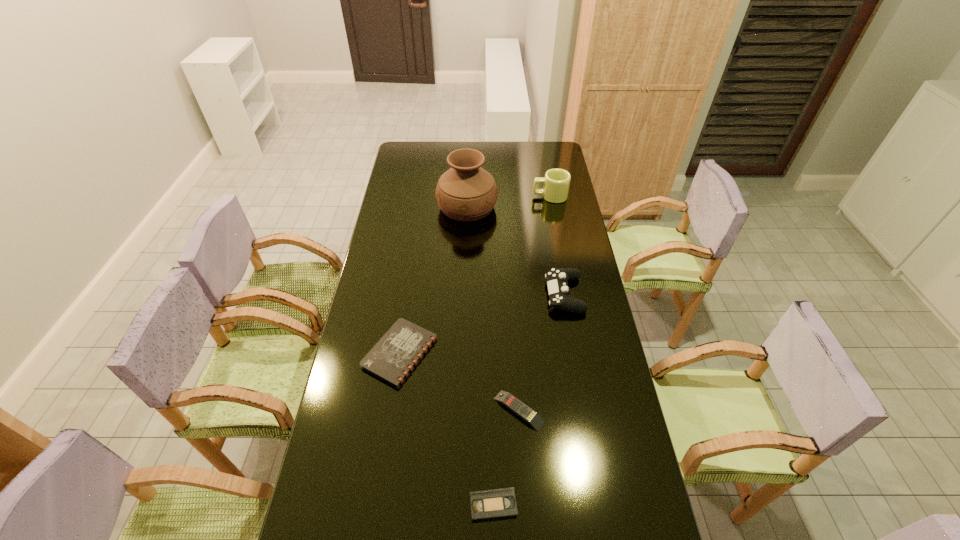
This screenshot has height=540, width=960. Identify the location of empty location between the remote control and the notebook. (460, 382).

What are the coordinates of `blank region between the fourth nearest object and the tallest object` in the screenshot? It's located at (516, 251).

Identify which object is the nearest to the second nearest object. Please provide its 2D coordinates. Your answer should be formatted as a tuple, i.e. [(x, y)], where the tuple contains the x and y coordinates of a point satisfying the conditions above.

[(498, 503)]

Select which object appears as the second closest to the remote control. Please provide its 2D coordinates. Your answer should be formatted as a tuple, i.e. [(x, y)], where the tuple contains the x and y coordinates of a point satisfying the conditions above.

[(394, 356)]

Image resolution: width=960 pixels, height=540 pixels. I want to click on vacant space that satisfies the following two spatial constraints: 1. on the front side of the shortest object; 2. on the right side of the notebook, so click(x=377, y=505).